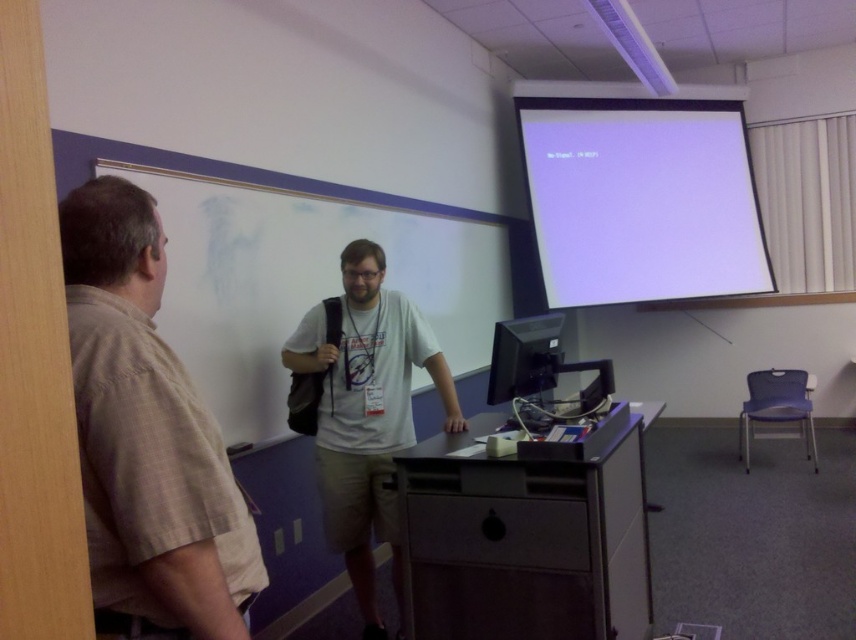
Question: Which of the following is the farthest from the observer?

Choices:
 (A) beige cotton shirt at left
 (B) white matte projection screen at upper right
 (C) white cotton t-shirt at center

Answer: (B)

Question: Which object is positioned closest to the beige cotton shirt at left?

Choices:
 (A) white matte projection screen at upper right
 (B) white cotton t-shirt at center
 (C) matte black monitor at center

Answer: (C)

Question: Is beige cotton shirt at left bigger than white matte projection screen at upper right?

Choices:
 (A) no
 (B) yes

Answer: (A)

Question: Which point is farther to the camera?

Choices:
 (A) matte black monitor at center
 (B) beige cotton shirt at left

Answer: (A)

Question: Considering the relative positions of beige cotton shirt at left and matte black monitor at center in the image provided, where is beige cotton shirt at left located with respect to matte black monitor at center?

Choices:
 (A) below
 (B) above

Answer: (B)

Question: Does white cotton t-shirt at center have a larger size compared to matte black monitor at center?

Choices:
 (A) no
 (B) yes

Answer: (B)